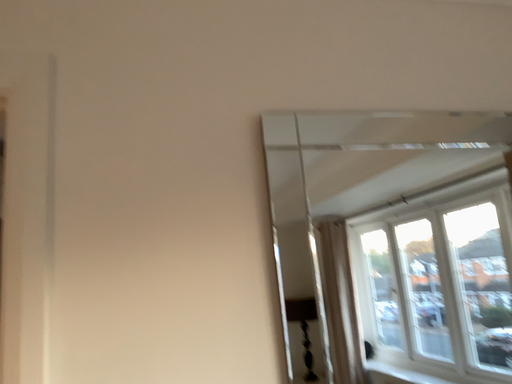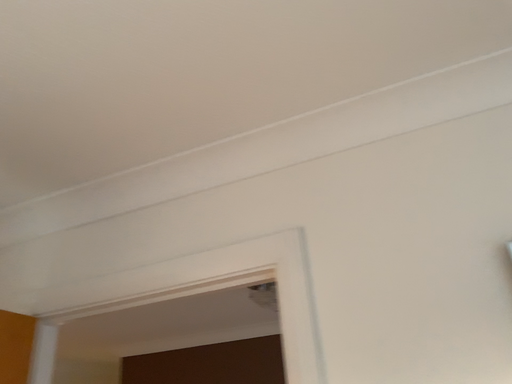
Question: How did the camera likely rotate when shooting the video?

Choices:
 (A) rotated left
 (B) rotated right

Answer: (A)